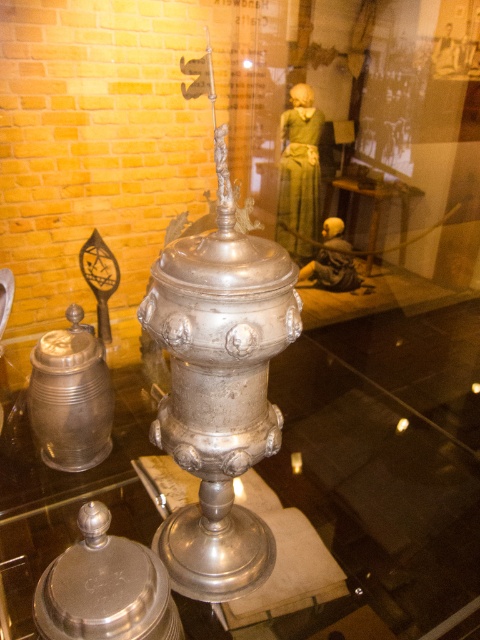
How much distance is there between polished silver teapot at lower left and polished silver tankard at left?

A distance of 27.67 inches exists between polished silver teapot at lower left and polished silver tankard at left.

Is point (48, 625) positioned in front of point (46, 461)?

Yes, it is.

Is point (178, 612) farther from camera compared to point (44, 445)?

No.

Identify the location of polished silver teapot at lower left. The height and width of the screenshot is (640, 480). (105, 588).